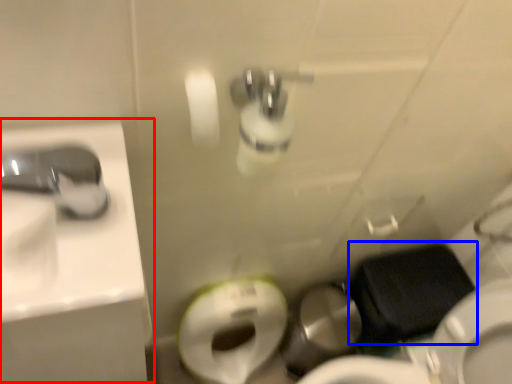
Question: Which object appears closest to the camera in this image, sink (highlighted by a red box) or sit (highlighted by a blue box)?

Choices:
 (A) sink
 (B) sit

Answer: (A)